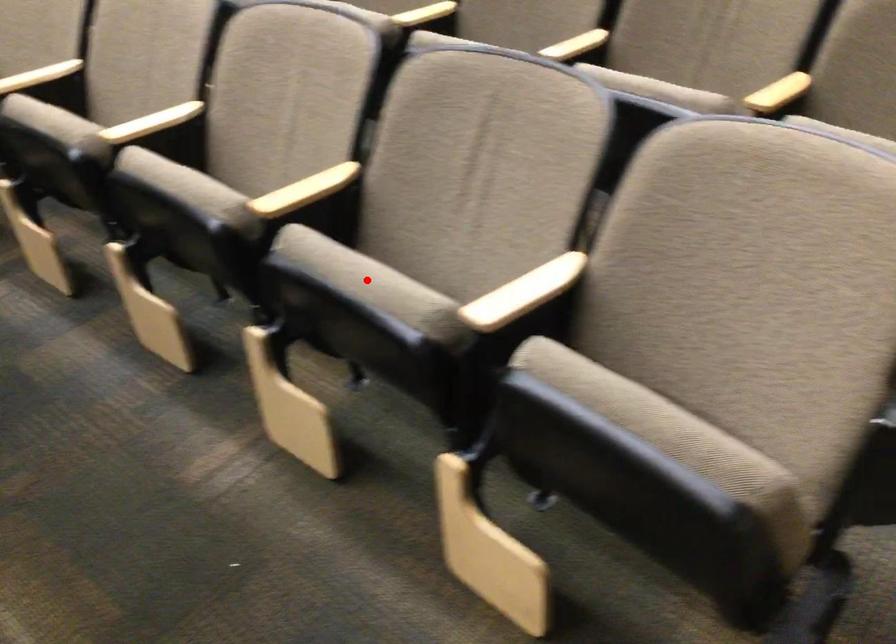
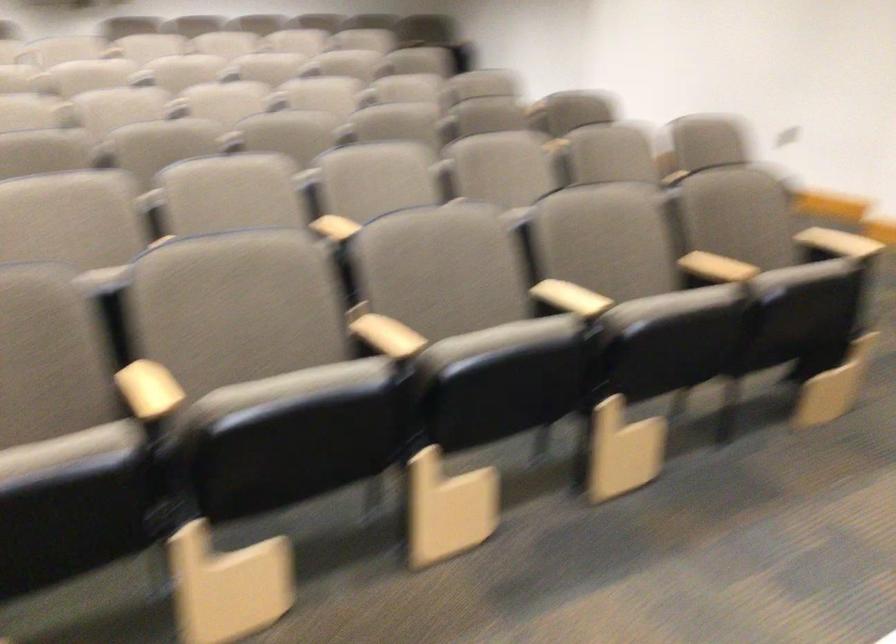
Question: I am providing you with two images of the same scene from different viewpoints. A red point is marked on the first image. At the location where the point appears in image 1, is it still visible in image 2?

Choices:
 (A) Yes
 (B) No

Answer: (B)